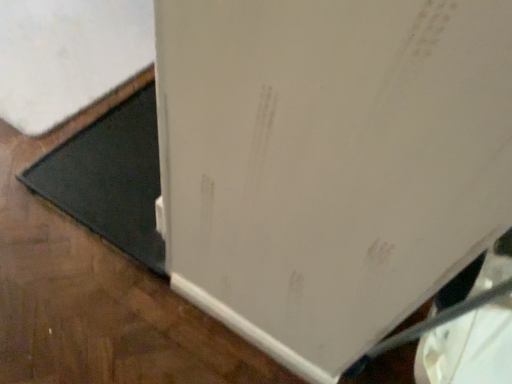
Locate an element on the screen. Image resolution: width=512 pixels, height=384 pixels. white matte refrigerator at lower right is located at coordinates (329, 162).

Describe the element at coordinates (329, 162) in the screenshot. I see `white matte refrigerator at lower right` at that location.

What is the approximate width of white matte refrigerator at lower right?

2.36 meters.

Measure the distance between black rubber doormat at lower left and camera.

black rubber doormat at lower left is 1.34 meters away from camera.

What do you see at coordinates (110, 178) in the screenshot? This screenshot has width=512, height=384. I see `black rubber doormat at lower left` at bounding box center [110, 178].

Locate an element on the screen. The height and width of the screenshot is (384, 512). black rubber doormat at lower left is located at coordinates (110, 178).

Where is `white matte refrigerator at lower right`? white matte refrigerator at lower right is located at coordinates (329, 162).

Which object is positioned more to the right, white matte refrigerator at lower right or black rubber doormat at lower left?

Positioned to the right is black rubber doormat at lower left.

In the scene shown: Is white matte refrigerator at lower right in front of or behind black rubber doormat at lower left in the image?

Clearly, white matte refrigerator at lower right is in front of black rubber doormat at lower left.

Is point (277, 7) less distant than point (152, 112)?

Yes, point (277, 7) is in front of point (152, 112).

From the image's perspective, does white matte refrigerator at lower right appear higher than black rubber doormat at lower left?

Yes, from the image's perspective, white matte refrigerator at lower right is above black rubber doormat at lower left.

From a real-world perspective, which is physically above, white matte refrigerator at lower right or black rubber doormat at lower left?

In real-world perspective, black rubber doormat at lower left is above.

Does white matte refrigerator at lower right have a lesser width compared to black rubber doormat at lower left?

Incorrect, the width of white matte refrigerator at lower right is not less than that of black rubber doormat at lower left.

Does white matte refrigerator at lower right have a greater height compared to black rubber doormat at lower left?

In fact, white matte refrigerator at lower right may be shorter than black rubber doormat at lower left.

Can you confirm if white matte refrigerator at lower right is smaller than black rubber doormat at lower left?

→ Incorrect, white matte refrigerator at lower right is not smaller in size than black rubber doormat at lower left.

Is white matte refrigerator at lower right completely or partially outside of black rubber doormat at lower left?

Yes, white matte refrigerator at lower right is not within black rubber doormat at lower left.

Is white matte refrigerator at lower right far from black rubber doormat at lower left?

That's not correct — white matte refrigerator at lower right is a little close to black rubber doormat at lower left.

Does white matte refrigerator at lower right turn towards black rubber doormat at lower left?

Yes, white matte refrigerator at lower right is oriented towards black rubber doormat at lower left.

Where is `refrigerator lying on the left of black rubber doormat at lower left`? The width and height of the screenshot is (512, 384). refrigerator lying on the left of black rubber doormat at lower left is located at coordinates (329, 162).

Which is more to the left, black rubber doormat at lower left or white matte refrigerator at lower right?

Positioned to the left is white matte refrigerator at lower right.

In the image, is black rubber doormat at lower left positioned in front of or behind white matte refrigerator at lower right?

In the image, black rubber doormat at lower left appears behind white matte refrigerator at lower right.

Does point (155, 243) come farther from viewer compared to point (505, 118)?

Yes, it is.

From the image's perspective, which one is positioned lower, black rubber doormat at lower left or white matte refrigerator at lower right?

black rubber doormat at lower left.

Consider the image. From a real-world perspective, is black rubber doormat at lower left under white matte refrigerator at lower right?

No.

Between black rubber doormat at lower left and white matte refrigerator at lower right, which one has larger width?

white matte refrigerator at lower right is wider.

Can you confirm if black rubber doormat at lower left is taller than white matte refrigerator at lower right?

Yes, black rubber doormat at lower left is taller than white matte refrigerator at lower right.

Who is smaller, black rubber doormat at lower left or white matte refrigerator at lower right?

With smaller size is black rubber doormat at lower left.

Can we say black rubber doormat at lower left lies outside white matte refrigerator at lower right?

No, black rubber doormat at lower left is inside white matte refrigerator at lower right's boundary.

Is black rubber doormat at lower left touching white matte refrigerator at lower right?

No, black rubber doormat at lower left is not with white matte refrigerator at lower right.

Does black rubber doormat at lower left turn towards white matte refrigerator at lower right?

Yes, black rubber doormat at lower left faces towards white matte refrigerator at lower right.

Measure the distance between black rubber doormat at lower left and white matte refrigerator at lower right.

27.35 inches.

Where is `refrigerator located in front of the black rubber doormat at lower left`? refrigerator located in front of the black rubber doormat at lower left is located at coordinates (329, 162).

Identify the location of refrigerator beneath the black rubber doormat at lower left (from a real-world perspective). (329, 162).

I want to click on refrigerator on the left of the black rubber doormat at lower left, so click(x=329, y=162).